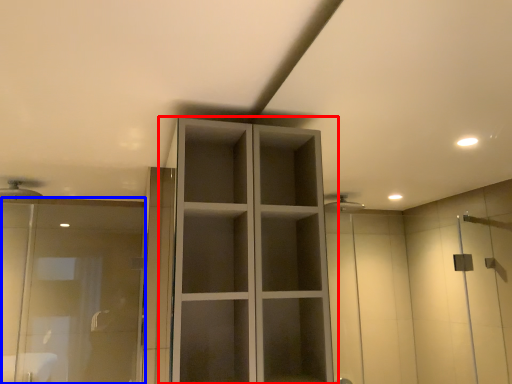
Question: Which of the following is the closest to the observer, cupboard (highlighted by a red box) or screen door (highlighted by a blue box)?

Choices:
 (A) cupboard
 (B) screen door

Answer: (A)